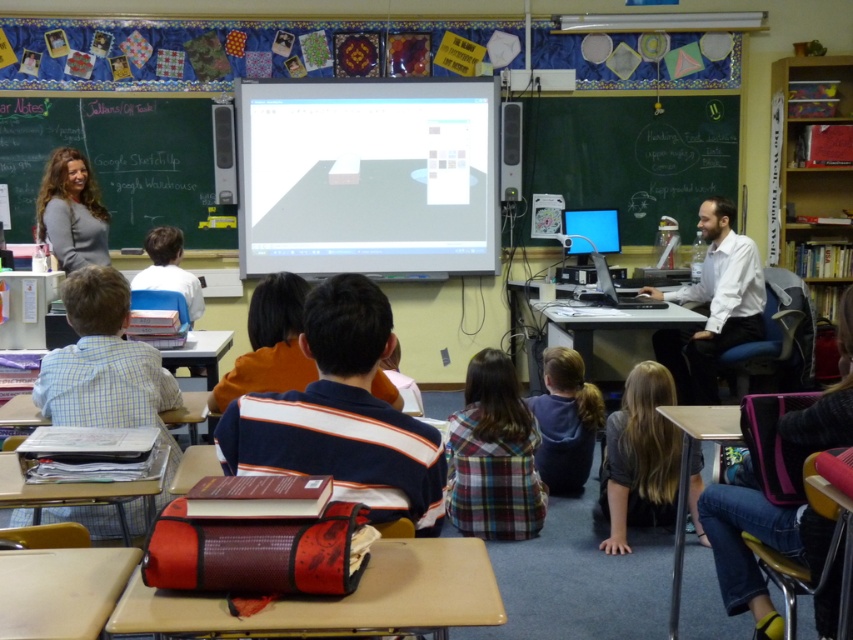
You are a student sitting at the desk with the red and black bag. The teacher is writing on the green chalkboard at upper left. If you want to take a photo of the teacher and the chalkboard using your phone camera, which is 0.1 meters wide, can you fit both the teacher and the chalkboard into the frame without moving your position?

The green chalkboard at upper left and camera are 5.47 meters apart from each other. Since the distance between them is greater than the width of your phone camera lens, you may not be able to capture both the teacher and the chalkboard in the same frame without moving closer or adjusting your angle.

You are a student sitting at the back of the classroom. You need to look at the green chalkboard at upper left and the dark gray shirt at lower center. Which object is taller?

The green chalkboard at upper left is taller than the dark gray shirt at lower center.